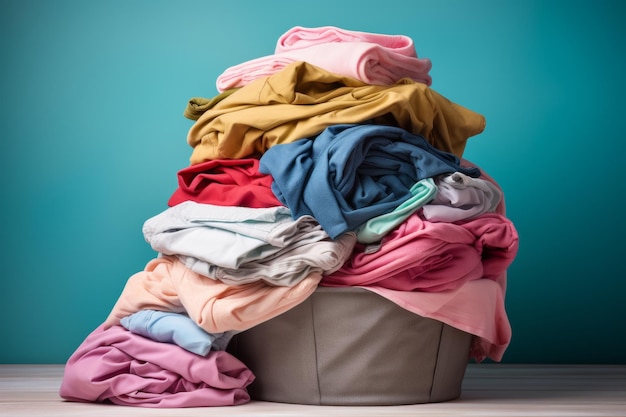
Where is `pinkish fabrics`? Image resolution: width=626 pixels, height=417 pixels. pinkish fabrics is located at coordinates (96, 375), (243, 301), (444, 245), (486, 313), (355, 61).